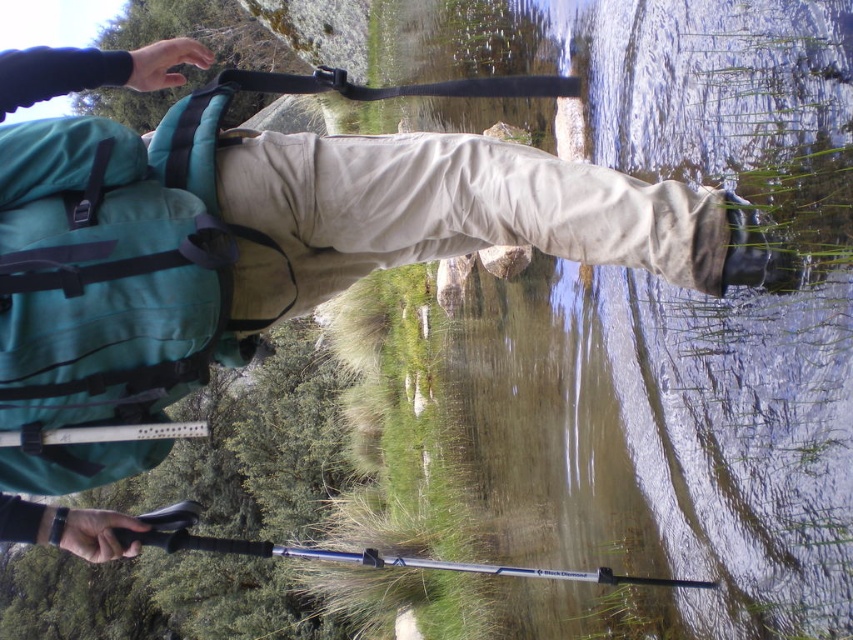
You are a hiker who needs to cross the clear water at lower center. Your backpack is the teal fabric backpack at left. Since the water is wider than your backpack, can you safely cross it if the water is only waist deep?

The clear water at lower center is wider than the teal fabric backpack at left. Since the water is only waist deep, you can safely cross it as the depth is manageable, but the width may require careful navigation depending on your stamina and the current.

You are a hiker who needs to place a 10 feet long tent between the clear water at lower center and the teal fabric backpack at left. Is there enough space between them?

The clear water at lower center and teal fabric backpack at left are 10.81 feet apart from each other. Since the tent is 10 feet long, there is enough space between them to place the tent.

You are a hiker trying to cross a narrow path between the clear water at lower center and the teal fabric backpack at left. Which object should you avoid stepping on to stay safe?

You should avoid stepping on the clear water at lower center because it is to the right of the teal fabric backpack at left, indicating it might be a pond or stream that you need to bypass.